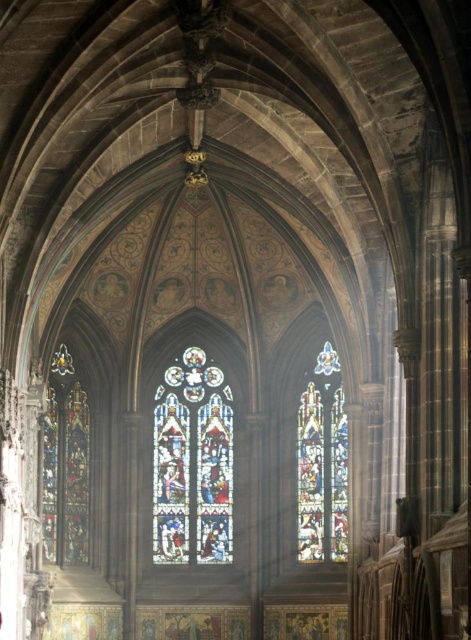
Question: Which of the following is the farthest from the observer?

Choices:
 (A) (206, 420)
 (B) (332, 385)

Answer: (A)

Question: Is stained glass window at center positioned before multicolored stained glass at center?

Choices:
 (A) yes
 (B) no

Answer: (B)

Question: Does stained glass window at center appear on the left side of multicolored stained glass at center?

Choices:
 (A) yes
 (B) no

Answer: (A)

Question: Which of the following is the closest to the observer?

Choices:
 (A) stained glass window at center
 (B) multicolored stained glass at center

Answer: (B)

Question: Among these points, which one is farthest from the camera?

Choices:
 (A) (308, 499)
 (B) (156, 470)

Answer: (B)

Question: Can you confirm if stained glass window at center is positioned to the left of multicolored stained glass at center?

Choices:
 (A) no
 (B) yes

Answer: (B)